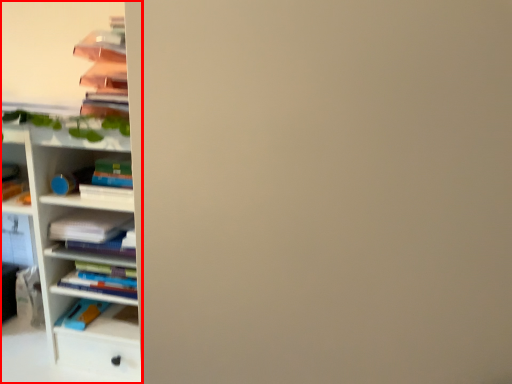
Question: Considering the relative positions of shelf (annotated by the red box) and book in the image provided, where is shelf (annotated by the red box) located with respect to the staircase?

Choices:
 (A) right
 (B) left

Answer: (B)